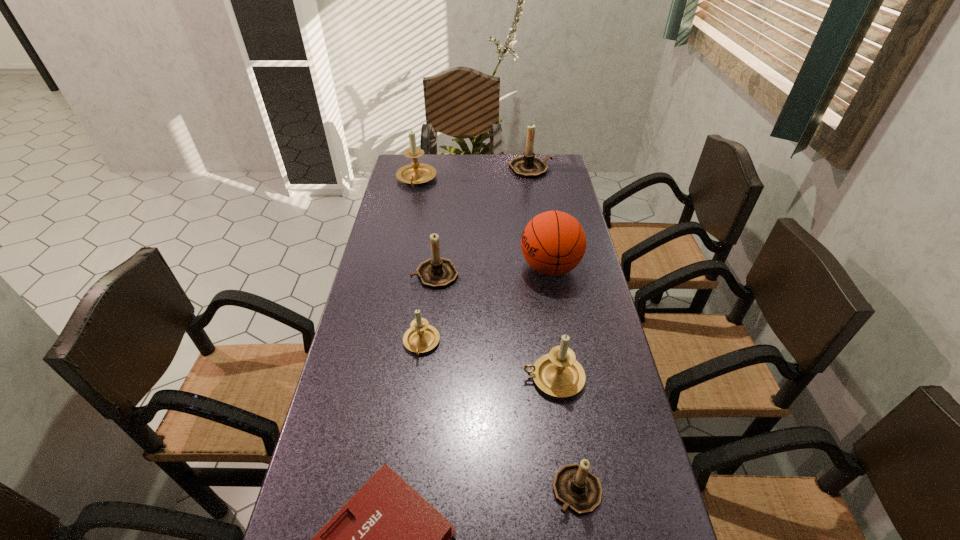
The width and height of the screenshot is (960, 540). I want to click on the farthest brown candle holder, so click(528, 166).

The width and height of the screenshot is (960, 540). I want to click on the farthest beige candle holder, so click(x=415, y=173).

Where is `basketball`? This screenshot has width=960, height=540. basketball is located at coordinates (553, 243).

The height and width of the screenshot is (540, 960). Identify the location of the leftmost brown candle holder. (437, 272).

Locate an element on the screen. This screenshot has height=540, width=960. the third farthest candle holder is located at coordinates (437, 272).

You are a GUI agent. You are given a task and a screenshot of the screen. Output one action in this format:
    pyautogui.click(x=<x>, y=<y>)
    Task: Click on the second biggest beige candle holder
    This screenshot has height=540, width=960.
    Given the screenshot: What is the action you would take?
    pyautogui.click(x=559, y=374)

Identify the location of the smallest beige candle holder. This screenshot has height=540, width=960. (421, 337).

Locate an element on the screen. the nearest candle holder is located at coordinates (577, 488).

You are a GUI agent. You are given a task and a screenshot of the screen. Output one action in this format:
    pyautogui.click(x=<x>, y=<y>)
    Task: Click on the smallest brown candle holder
    
    Given the screenshot: What is the action you would take?
    pyautogui.click(x=577, y=488)

Identify the location of vacant space located 0.140m on the front of the biggest brown candle holder. Image resolution: width=960 pixels, height=540 pixels. (535, 198).